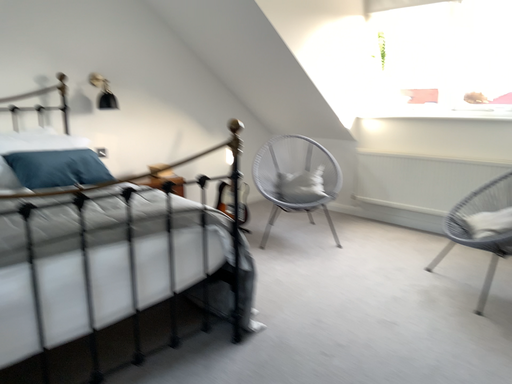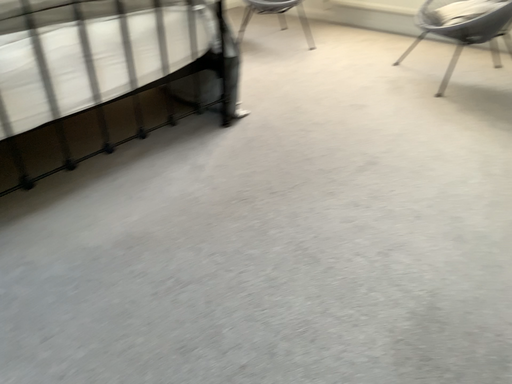
Question: How did the camera likely rotate when shooting the video?

Choices:
 (A) rotated upward
 (B) rotated downward

Answer: (B)